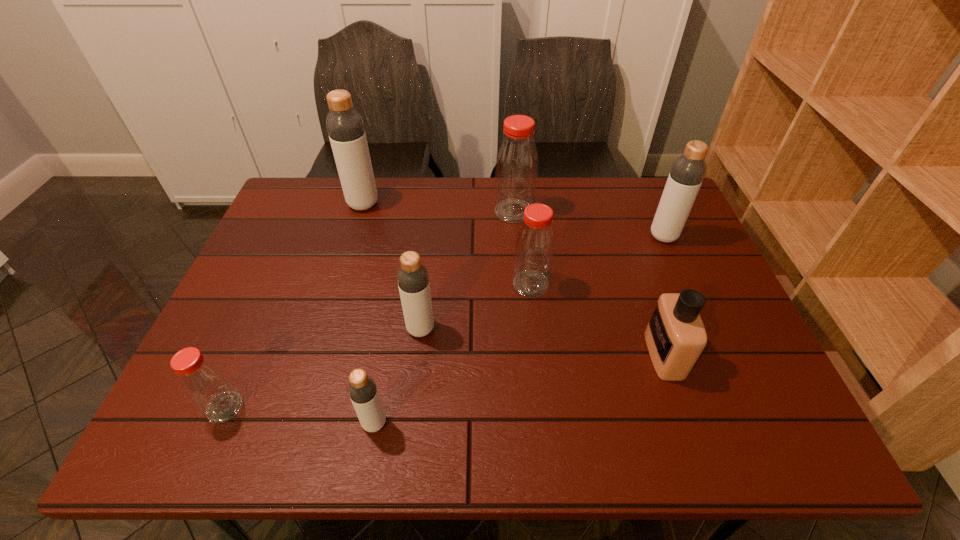
This screenshot has height=540, width=960. What are the coordinates of `the second object from right to left` in the screenshot? It's located at (675, 336).

Where is `the smallest gray bottle`? The height and width of the screenshot is (540, 960). the smallest gray bottle is located at coordinates (362, 389).

The image size is (960, 540). Identify the location of the nearest gray bottle. (362, 389).

Find the location of `the leftmost object`. the leftmost object is located at coordinates tap(203, 381).

Find the location of `the leftmost red bottle`. the leftmost red bottle is located at coordinates (203, 381).

Image resolution: width=960 pixels, height=540 pixels. Identify the location of vacant point located 0.240m on the front of the tallest object. (344, 268).

You are a GUI agent. You are given a task and a screenshot of the screen. Output one action in this format:
    pyautogui.click(x=<x>, y=<y>)
    Task: Click on the free region located on the right of the farthest red bottle
    The image size is (960, 540).
    Given the screenshot: What is the action you would take?
    pyautogui.click(x=591, y=211)

Locate an element on the screen. This screenshot has width=960, height=540. vacant space located 0.340m on the left of the third farthest object is located at coordinates (534, 237).

You are a GUI agent. You are given a task and a screenshot of the screen. Output one action in this format:
    pyautogui.click(x=<x>, y=<y>)
    Task: Click on the vacant space located 0.280m on the right of the fifth nearest object
    This screenshot has height=540, width=960.
    Given the screenshot: What is the action you would take?
    pyautogui.click(x=656, y=284)

This screenshot has height=540, width=960. Find the location of `vacant position located on the back of the fifth farthest bottle`. vacant position located on the back of the fifth farthest bottle is located at coordinates (432, 232).